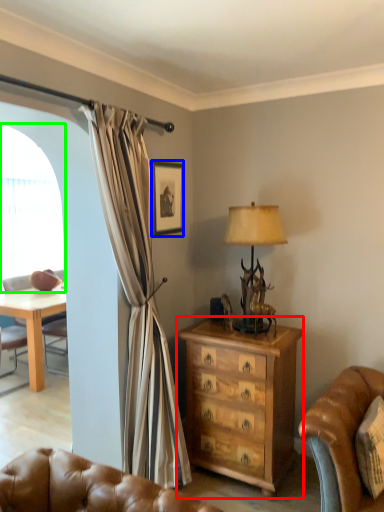
Question: Estimate the real-world distances between objects in this image. Which object is closer to chest of drawers (highlighted by a red box), picture frame (highlighted by a blue box) or window screen (highlighted by a green box)?

Choices:
 (A) picture frame
 (B) window screen

Answer: (A)